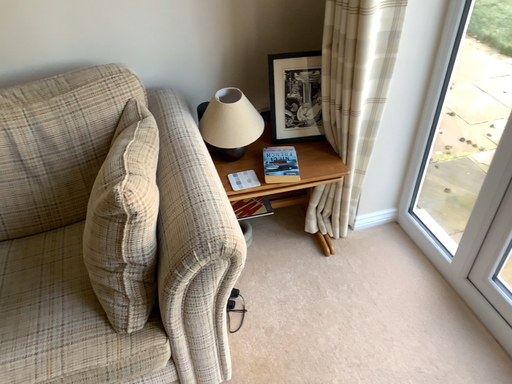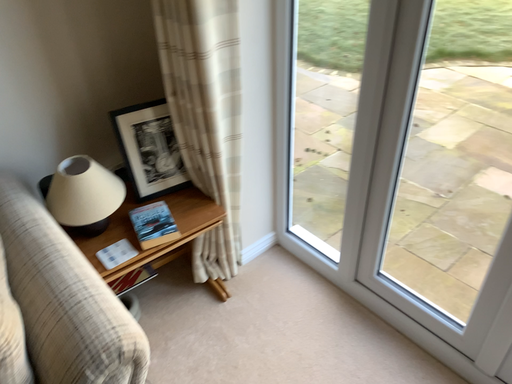
Question: Which way did the camera rotate in the video?

Choices:
 (A) rotated upward
 (B) rotated downward

Answer: (A)